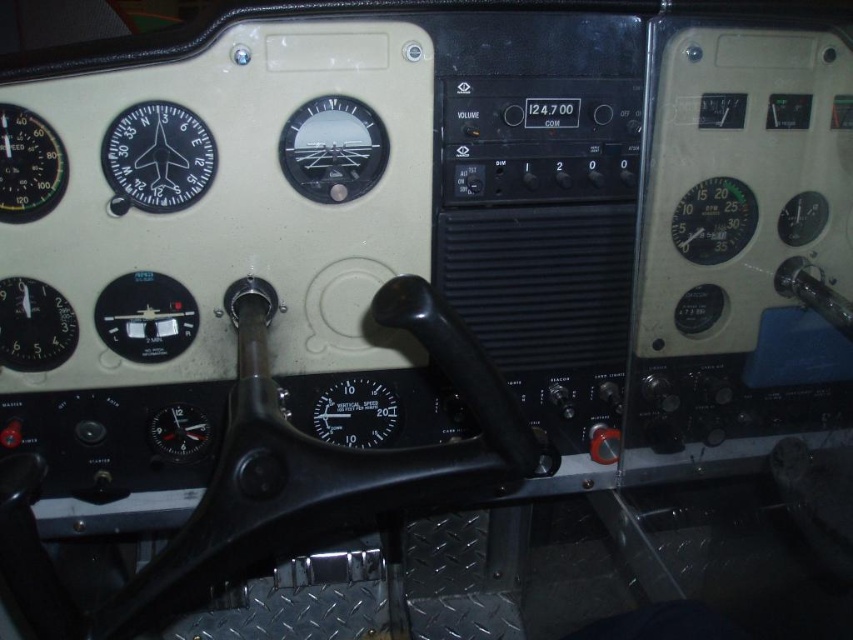
Which of these two, matte black compass at upper left or matte black gauge at lower left, stands taller?

matte black compass at upper left is taller.

Who is positioned more to the right, matte black compass at upper left or matte black gauge at lower left?

matte black compass at upper left

Does point (161, 147) lie in front of point (10, 323)?

Yes, it is in front of point (10, 323).

The height and width of the screenshot is (640, 853). I want to click on matte black compass at upper left, so click(157, 157).

Does matte black compass at upper left appear over matte black gauge at upper left?

Correct, matte black compass at upper left is located above matte black gauge at upper left.

Does point (109, 132) lie in front of point (15, 120)?

That is False.

Is point (132, 140) farther from camera compared to point (25, 150)?

Yes, point (132, 140) is farther from viewer.

This screenshot has height=640, width=853. I want to click on matte black compass at upper left, so click(x=157, y=157).

Can you confirm if matte black gauge at center is positioned to the left of green matte gauge at upper right?

Correct, you'll find matte black gauge at center to the left of green matte gauge at upper right.

Is matte black gauge at center further to camera compared to green matte gauge at upper right?

No, matte black gauge at center is closer to the viewer.

At what (x,y) coordinates should I click in order to perform the action: click on matte black gauge at center. Please return your answer as a coordinate pair (x, y). Looking at the image, I should click on (332, 148).